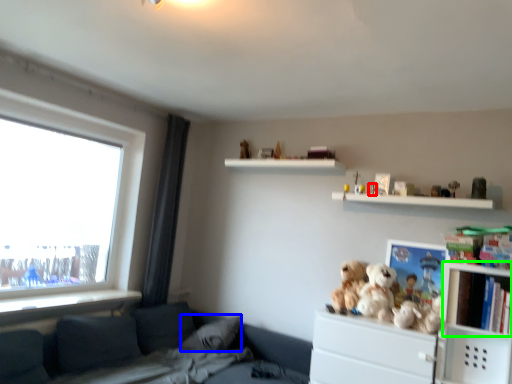
Question: Which is farther away from toy (highlighted by a red box)? pillow (highlighted by a blue box) or cabinet (highlighted by a green box)?

Choices:
 (A) pillow
 (B) cabinet

Answer: (A)